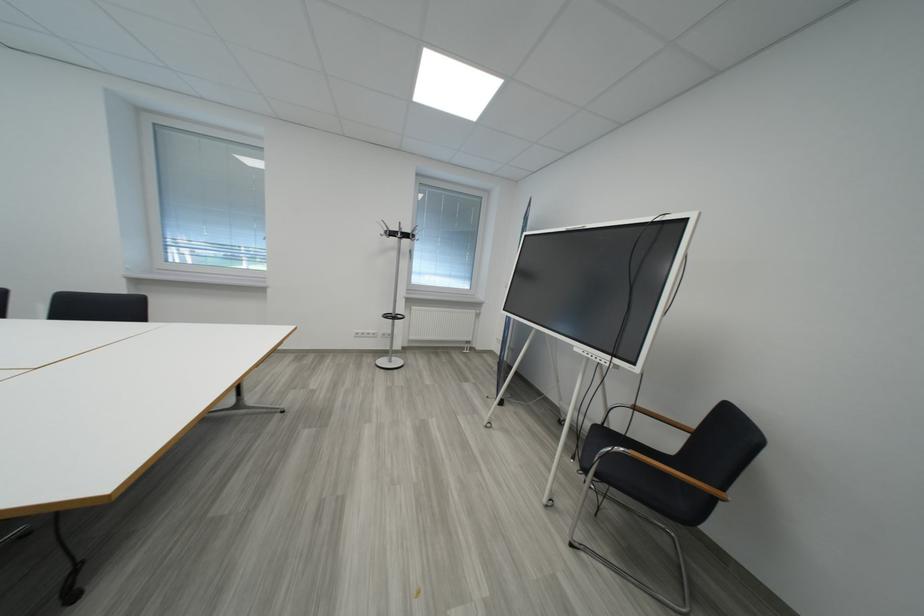
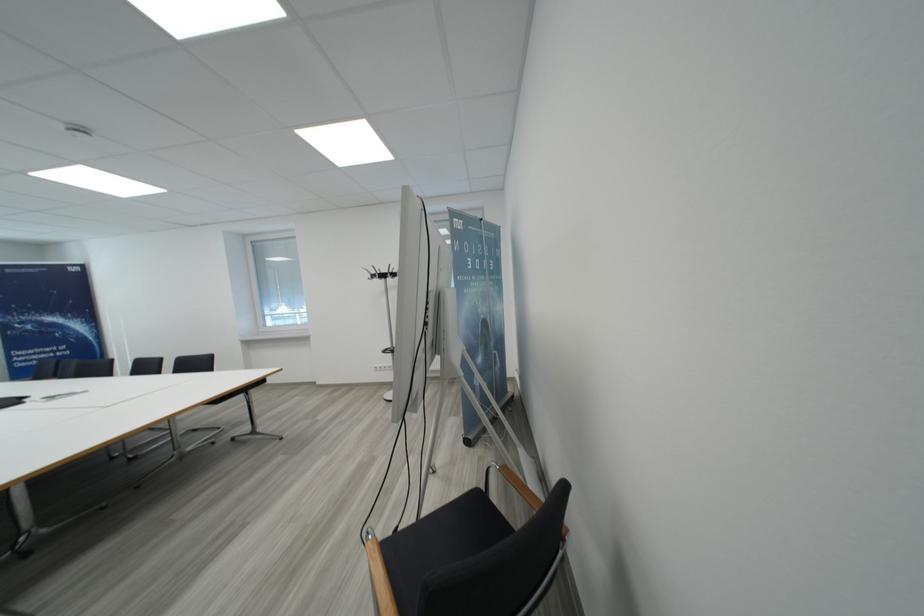
Question: The images are taken continuously from a first-person perspective. In which direction are you moving?

Choices:
 (A) Left
 (B) Right
 (C) Forward
 (D) Backward

Answer: (B)